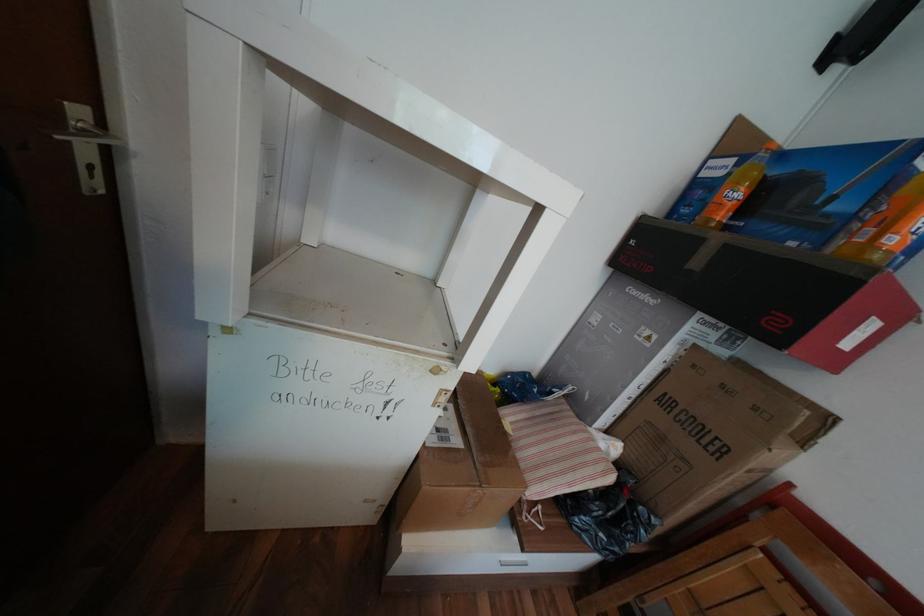
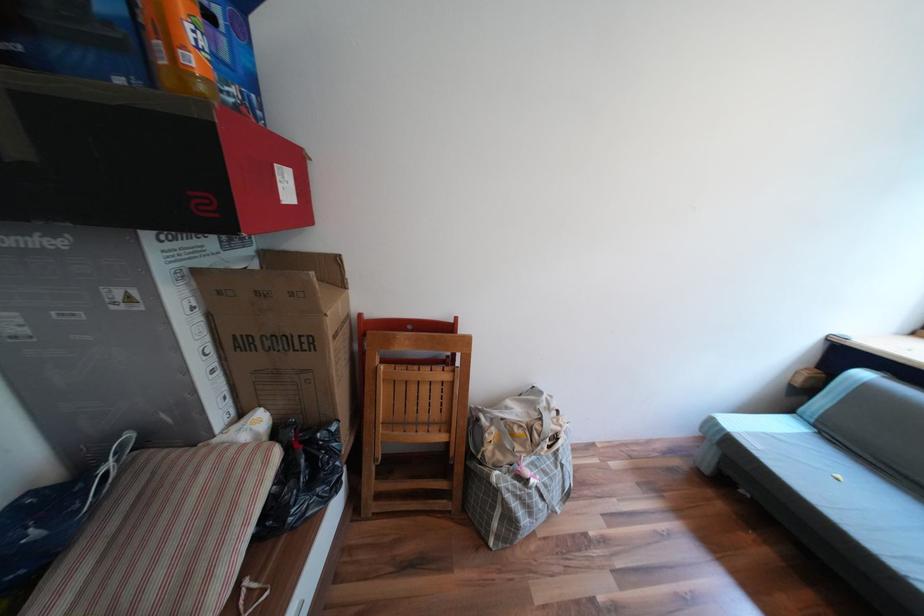
Where in the second image is the point corresponding to (x=864, y=333) from the first image?

(289, 185)